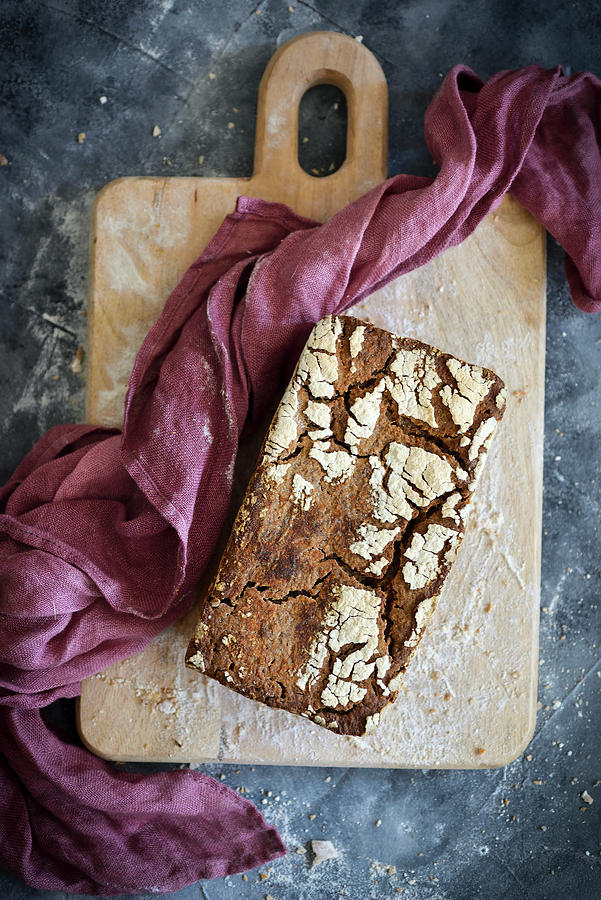
The image size is (601, 900). Find the location of `cutting board handle`. cutting board handle is located at coordinates (287, 100).